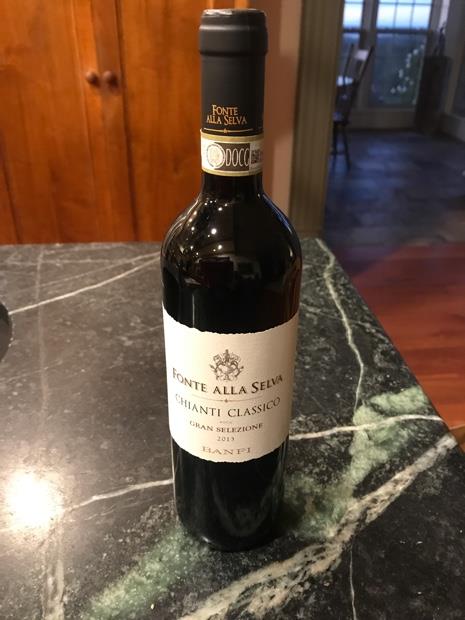
I want to click on countertop, so click(86, 359), click(107, 549), click(375, 513), click(325, 277).